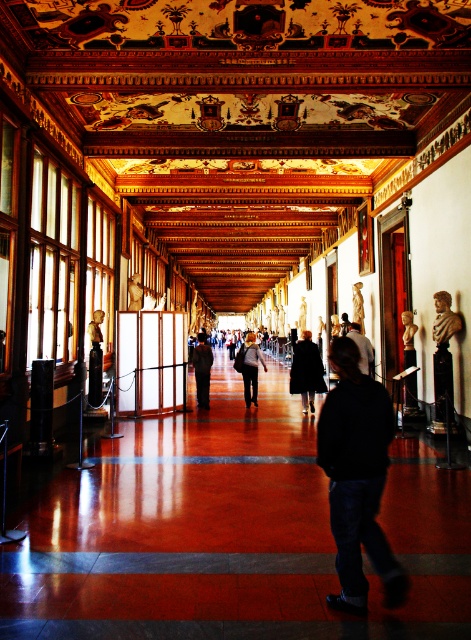
You are an interior designer assessing the hallway. You need to place a 1.2 meter tall decorative statue between the dark gray fabric coat at center and the dark brown leather jacket at center. Given their heights, which object should the statue be placed closer to?

The dark gray fabric coat at center is taller than the dark brown leather jacket at center. To maintain visual balance, the statue should be placed closer to the shorter dark brown leather jacket at center to compensate for the height difference.

You are a security guard in the museum and notice two coats hanging on a rack at the center of the hallway. You need to determine which one is taller. Which one is taller between the black coat at center and the dark brown leather jacket at center?

The black coat at center is taller than the dark brown leather jacket at center.

You are standing at the entrance of the hallway and notice both the dark gray fabric coat at center and the dark brown leather jacket at center. Which one is nearer to you?

The dark gray fabric coat at center is closer to the viewer than the dark brown leather jacket at center.